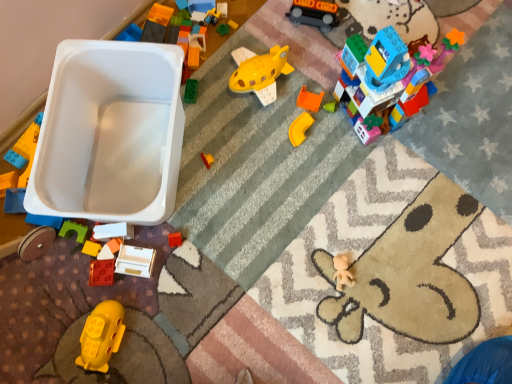
Where is `unoccupied region to the right of rubberized orange block at lower left, acting as the fourth toy starting from the bottom`? The image size is (512, 384). unoccupied region to the right of rubberized orange block at lower left, acting as the fourth toy starting from the bottom is located at coordinates (162, 258).